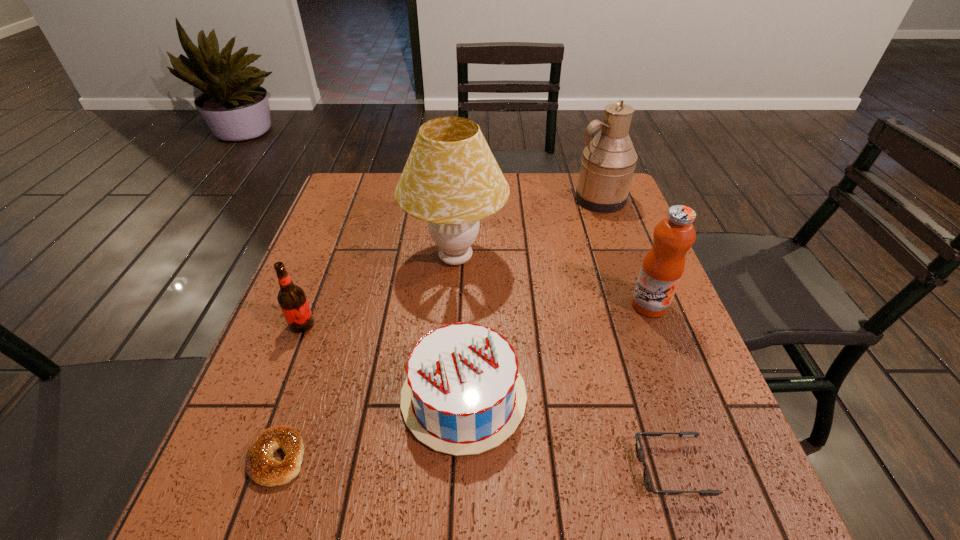
The height and width of the screenshot is (540, 960). In order to click on lampshade in this screenshot , I will do `click(451, 180)`.

Where is `pitcher`? This screenshot has height=540, width=960. pitcher is located at coordinates (607, 166).

You are a GUI agent. You are given a task and a screenshot of the screen. Output one action in this format:
    pyautogui.click(x=<x>, y=<y>)
    Task: Click on the fruit juice
    The height and width of the screenshot is (540, 960).
    Given the screenshot: What is the action you would take?
    pyautogui.click(x=663, y=266)

This screenshot has width=960, height=540. I want to click on the fourth tallest object, so click(x=292, y=300).

The image size is (960, 540). Find the location of `birthday cake`. birthday cake is located at coordinates (463, 395).

Where is `sunglasses`? The height and width of the screenshot is (540, 960). sunglasses is located at coordinates (648, 481).

You are a GUI agent. You are given a task and a screenshot of the screen. Output one action in this format:
    pyautogui.click(x=<x>, y=<y>)
    Task: Click on the bagel
    The height and width of the screenshot is (540, 960).
    Given the screenshot: What is the action you would take?
    pyautogui.click(x=261, y=466)

This screenshot has height=540, width=960. I want to click on free space located 0.250m on the front of the lampshade, so click(x=448, y=382).

Where is `free location located 0.290m on the left of the farthest object`? free location located 0.290m on the left of the farthest object is located at coordinates (479, 199).

What are the coordinates of `vacant space located 0.120m on the front label of the fifth shortest object` in the screenshot? It's located at (671, 362).